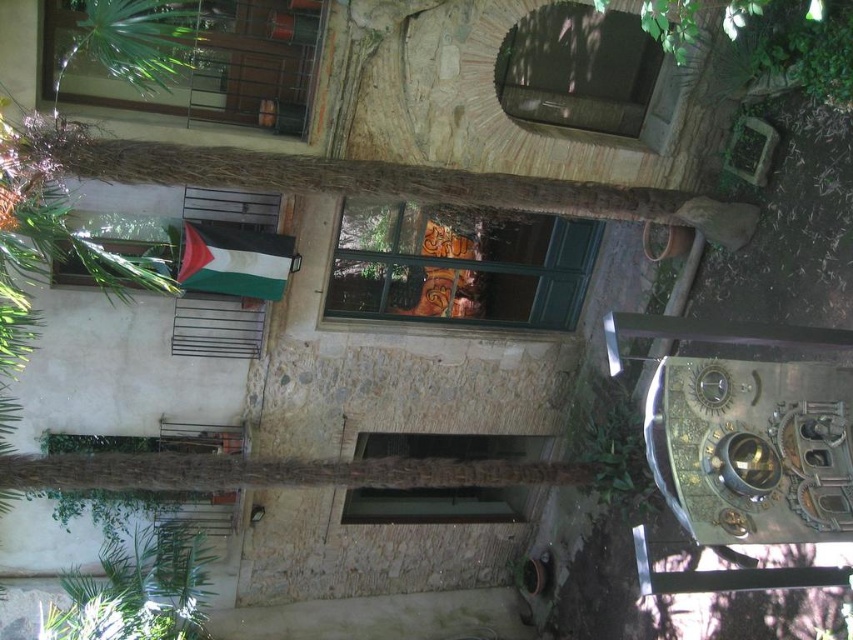
You are an architect designing a new courtyard. You want to place a large sculpture between the metallic balcony at upper left and the green leafy tree at lower left. Based on their sizes, which object should the sculpture be closer to?

The sculpture should be closer to the green leafy tree at lower left because the metallic balcony at upper left has a smaller size compared to the green leafy tree at lower left, so the tree can better accommodate a larger sculpture nearby.

You are a painter standing at the base of the green leafy tree at lower left, and you want to paint the metallic balcony at upper left. If your ladder can reach up to 4 meters, will you be able to reach the balcony?

The distance between the metallic balcony at upper left and the green leafy tree at lower left is 4.43 meters. Since the ladder can only reach up to 4 meters, you will not be able to reach the balcony with the current ladder.